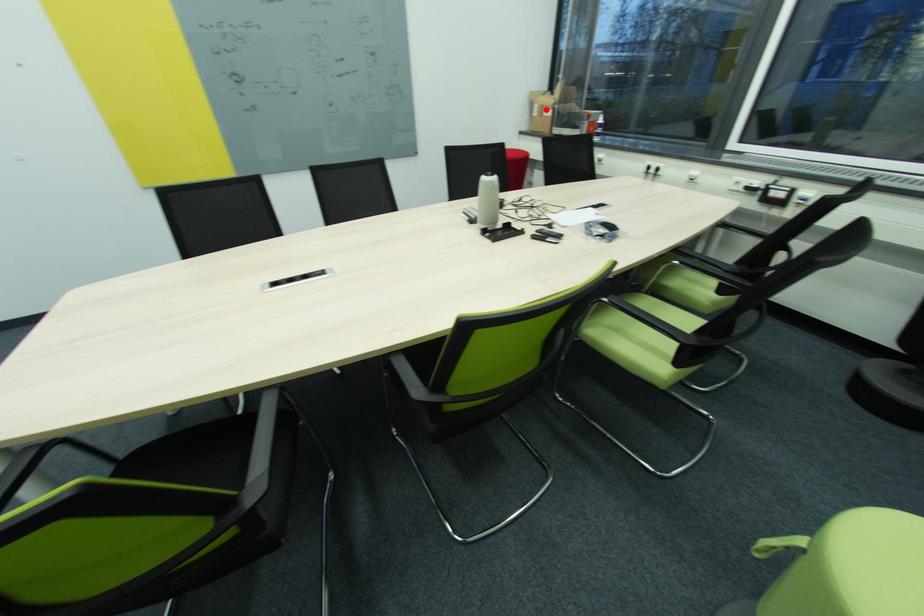
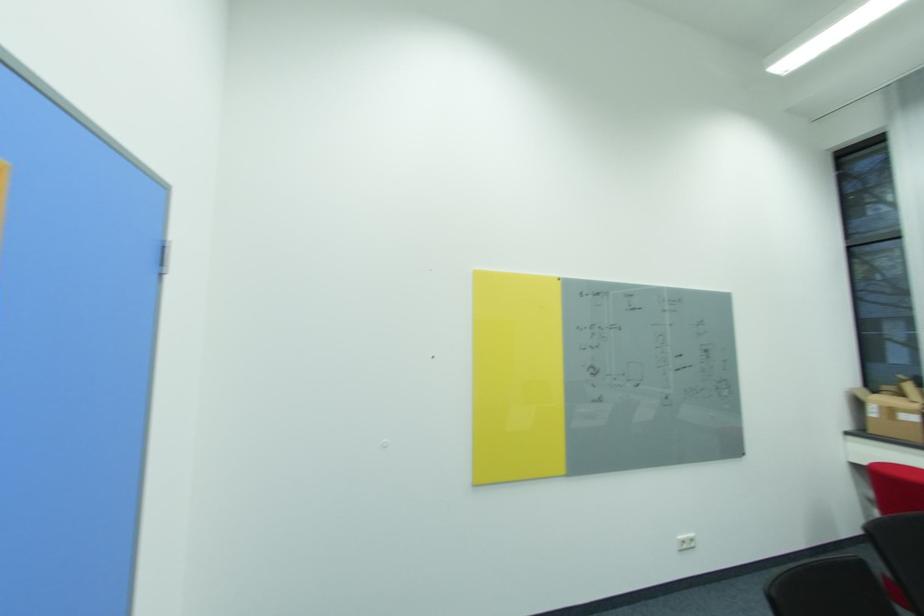
Locate, in the second image, the point that corresponds to the highlighted location in the first image.

(895, 411)